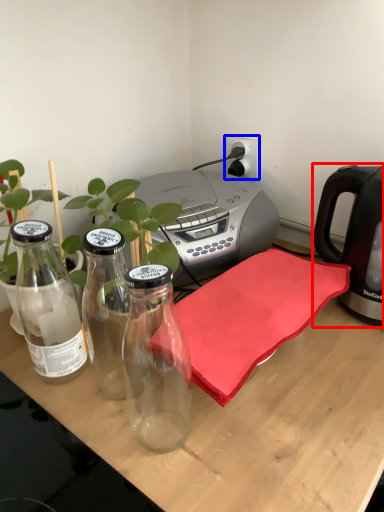
Question: Which of the following is the farthest to the observer, kettle (highlighted by a red box) or electric outlet (highlighted by a blue box)?

Choices:
 (A) kettle
 (B) electric outlet

Answer: (B)